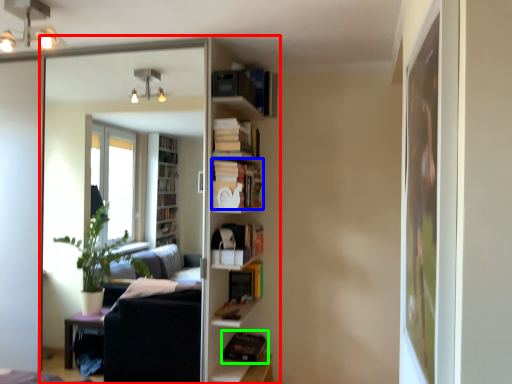
Question: Which is nearer to the entertainment center (highlighted by a red box)? book (highlighted by a blue box) or book (highlighted by a green box).

Choices:
 (A) book
 (B) book

Answer: (B)